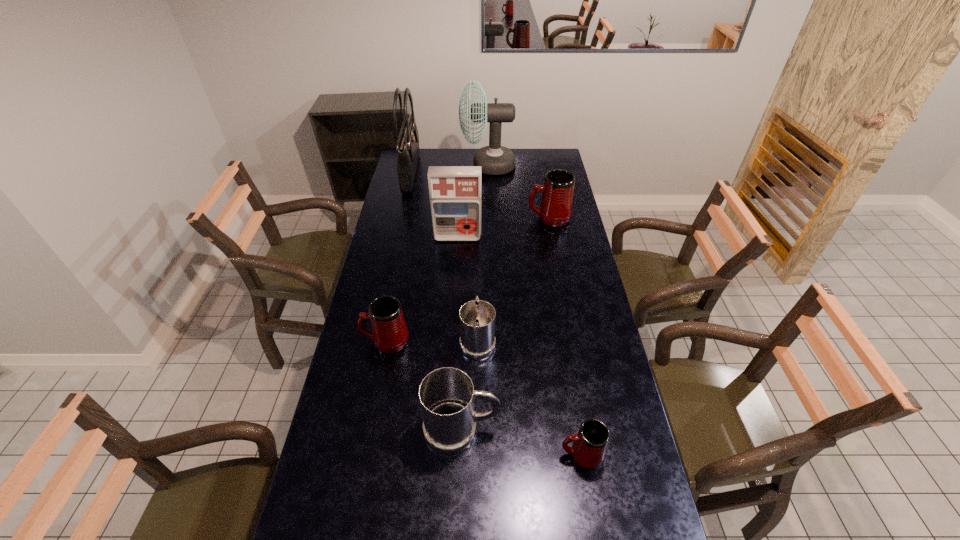
I want to click on object that is the fourth closest to the leftmost mug, so click(589, 446).

This screenshot has width=960, height=540. I want to click on object that is the third nearest to the shortest object, so click(x=389, y=332).

Find the location of a particular element. The width and height of the screenshot is (960, 540). mug that stands as the closest to the second smallest red mug is located at coordinates (477, 317).

Identify which mug is the fourth closest to the second biggest red mug. Please provide its 2D coordinates. Your answer should be formatted as a tuple, i.e. [(x, y)], where the tuple contains the x and y coordinates of a point satisfying the conditions above.

[(556, 204)]

Select which red mug is the second closest to the leftmost mug. Please provide its 2D coordinates. Your answer should be formatted as a tuple, i.e. [(x, y)], where the tuple contains the x and y coordinates of a point satisfying the conditions above.

[(556, 204)]

This screenshot has height=540, width=960. In order to click on the second closest red mug relative to the second biggest red mug in this screenshot , I will do `click(556, 204)`.

Find the location of a particular element. Image resolution: width=960 pixels, height=540 pixels. gray mug that is the second closest to the second smallest red mug is located at coordinates (447, 394).

At what (x,y) coordinates should I click in order to perform the action: click on gray mug that is the second closest one to the leftmost red mug. Please return your answer as a coordinate pair (x, y). The width and height of the screenshot is (960, 540). Looking at the image, I should click on (447, 394).

Where is `vacant point that satisfies the following two spatial constraints: 1. in front of the fan where the airflow is directed; 2. on the front-facing side of the fifth nearest object`? The image size is (960, 540). vacant point that satisfies the following two spatial constraints: 1. in front of the fan where the airflow is directed; 2. on the front-facing side of the fifth nearest object is located at coordinates (490, 237).

You are a GUI agent. You are given a task and a screenshot of the screen. Output one action in this format:
    pyautogui.click(x=<x>, y=<y>)
    Task: Click on the free space that satisfies the following two spatial constraints: 1. on the side of the farther gray mug with the handle; 2. with an open clasp on the front of the black handbag
    The height and width of the screenshot is (540, 960).
    Given the screenshot: What is the action you would take?
    (478, 173)